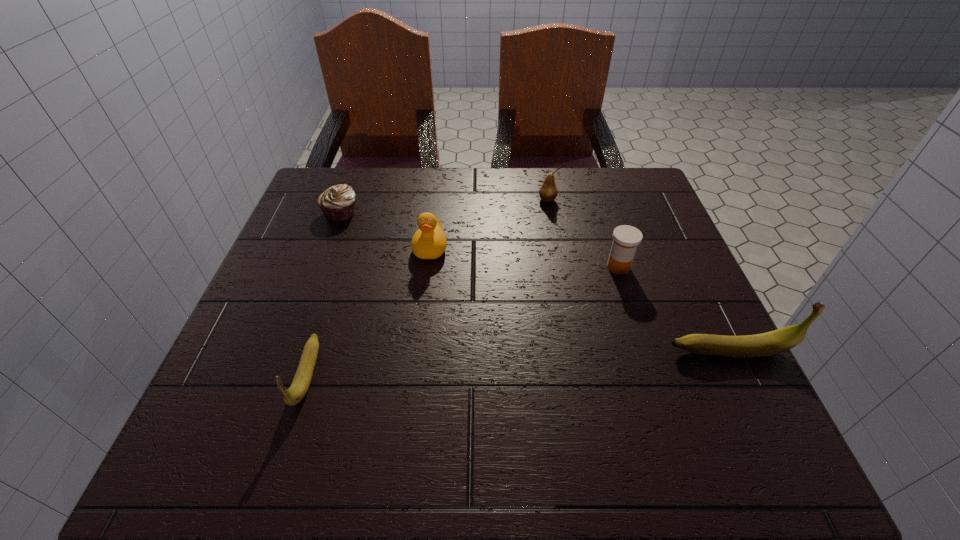
Locate an element on the screen. free spot located on the label of the medicine is located at coordinates (505, 267).

Locate an element on the screen. Image resolution: width=960 pixels, height=540 pixels. free location located on the label of the medicine is located at coordinates (427, 267).

The width and height of the screenshot is (960, 540). I want to click on free space located on the face of the duck, so click(410, 415).

Image resolution: width=960 pixels, height=540 pixels. Find the location of `pear located at the far edge`. pear located at the far edge is located at coordinates (548, 191).

I want to click on muffin located in the far edge section of the desktop, so click(337, 203).

At what (x,y) coordinates should I click in order to perform the action: click on object present at the near edge. Please return your answer as a coordinate pair (x, y). This screenshot has height=540, width=960. Looking at the image, I should click on (300, 384).

Locate an element on the screen. Image resolution: width=960 pixels, height=540 pixels. banana that is at the left edge is located at coordinates (300, 384).

Where is `muffin at the left edge`? The width and height of the screenshot is (960, 540). muffin at the left edge is located at coordinates (337, 203).

This screenshot has width=960, height=540. Find the location of `banana that is at the right edge`. banana that is at the right edge is located at coordinates (774, 342).

Locate an element on the screen. medicine at the right edge is located at coordinates (626, 238).